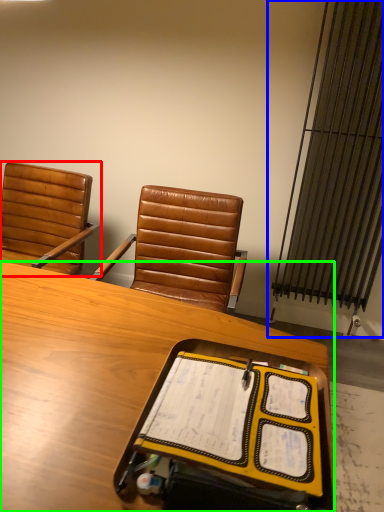
Question: Based on their relative distances, which object is nearer to chair (highlighted by a red box)? Choose from radiator (highlighted by a blue box) and desk (highlighted by a green box).

Choices:
 (A) radiator
 (B) desk

Answer: (B)